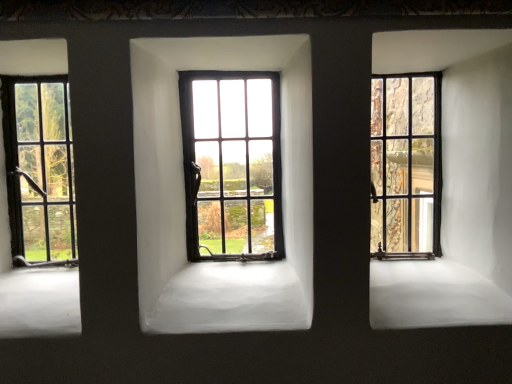
Question: Does point (23, 203) appear closer or farther from the camera than point (433, 182)?

Choices:
 (A) closer
 (B) farther

Answer: (A)

Question: Is matte black window at left, the third window viewed from the right, wider or thinner than matte black window at right, positioned as the 3th window in left-to-right order?

Choices:
 (A) wide
 (B) thin

Answer: (A)

Question: Which of these objects is positioned farthest from the matte black window at center, arranged as the second window when viewed from the right?

Choices:
 (A) matte black window at left, the third window viewed from the right
 (B) matte black window at right, marked as the 1th window in a right-to-left arrangement

Answer: (A)

Question: Estimate the real-world distances between objects in this image. Which object is farther from the matte black window at left, the third window viewed from the right?

Choices:
 (A) matte black window at center, which is the 2th window from left to right
 (B) matte black window at right, marked as the 1th window in a right-to-left arrangement

Answer: (B)